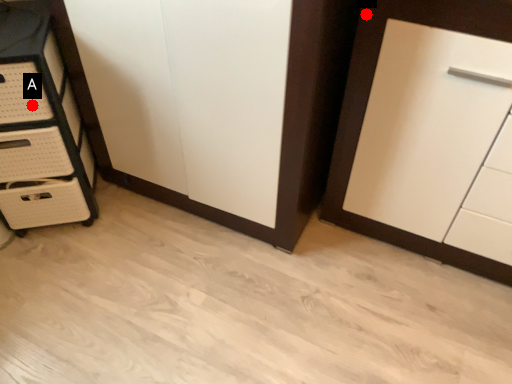
Question: Two points are circled on the image, labeled by A and B beside each circle. Which point appears closest to the camera in this image?

Choices:
 (A) A is closer
 (B) B is closer

Answer: (B)